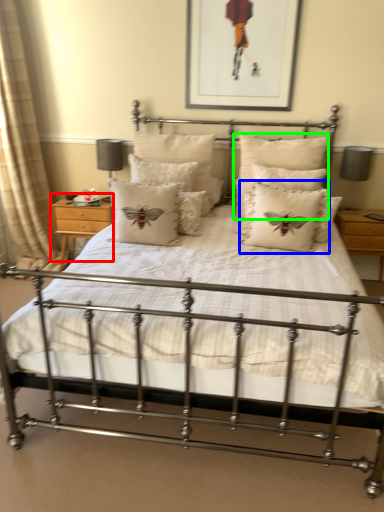
Question: Which object is the closest to the nightstand (highlighted by a red box)? Choose among these: pillow (highlighted by a blue box) or pillow (highlighted by a green box).

Choices:
 (A) pillow
 (B) pillow

Answer: (B)